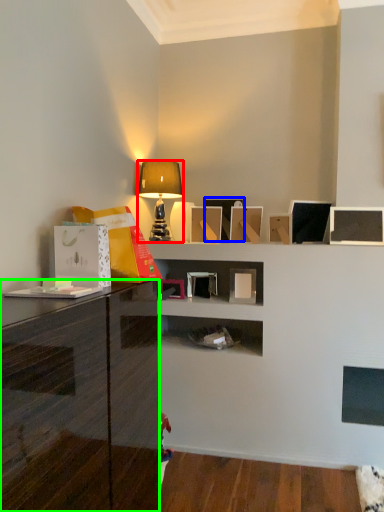
Question: Estimate the real-world distances between objects in this image. Which object is closer to lamp (highlighted by a red box), picture frame (highlighted by a blue box) or cabinetry (highlighted by a green box)?

Choices:
 (A) picture frame
 (B) cabinetry

Answer: (A)